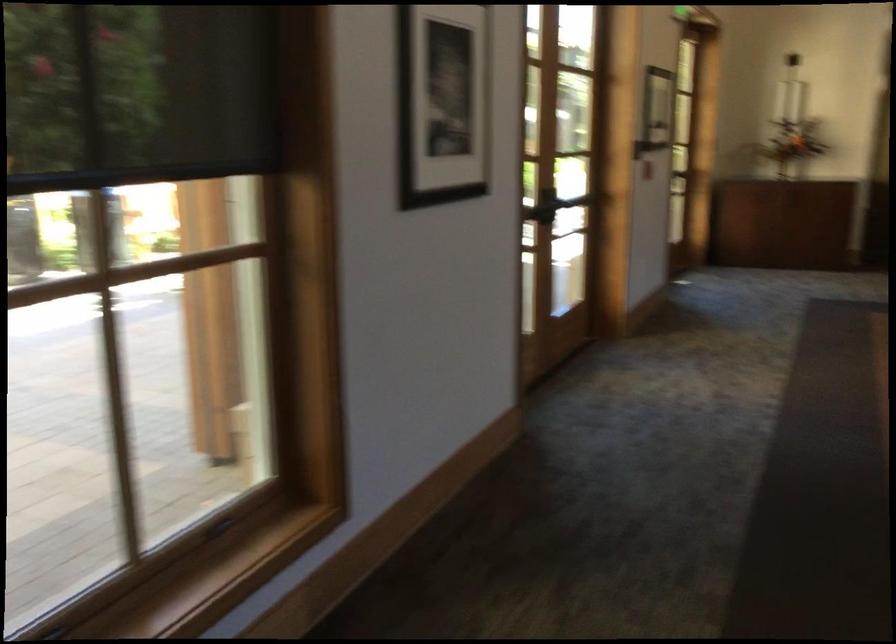
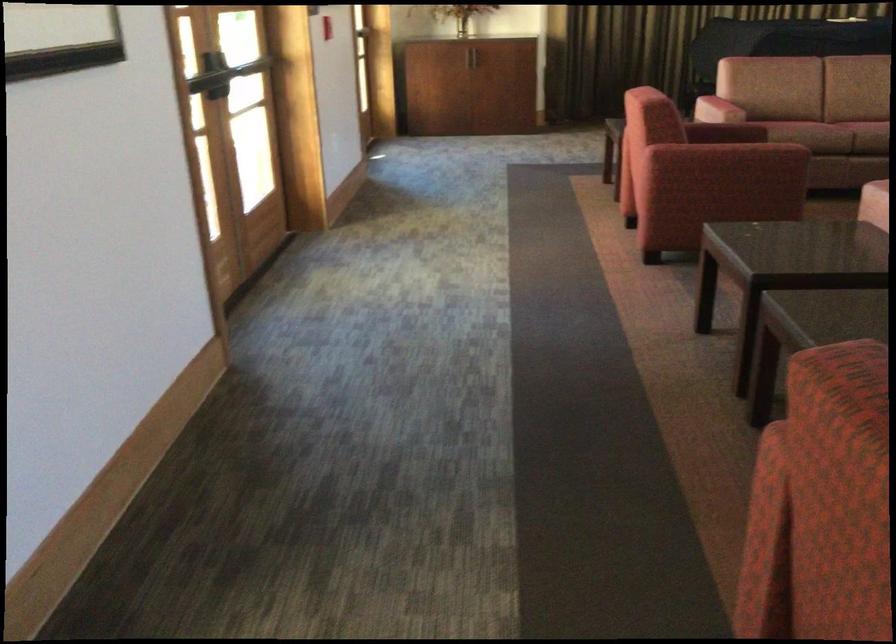
Question: The camera is either moving clockwise (left) or counter-clockwise (right) around the object. The first image is from the beginning of the video and the second image is from the end. Is the camera moving left or right when shooting the video?

Choices:
 (A) Left
 (B) Right

Answer: (A)